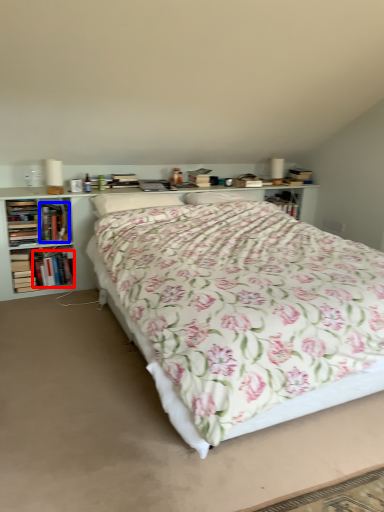
Question: Which object appears farthest to the camera in this image, book (highlighted by a red box) or book (highlighted by a blue box)?

Choices:
 (A) book
 (B) book

Answer: (A)